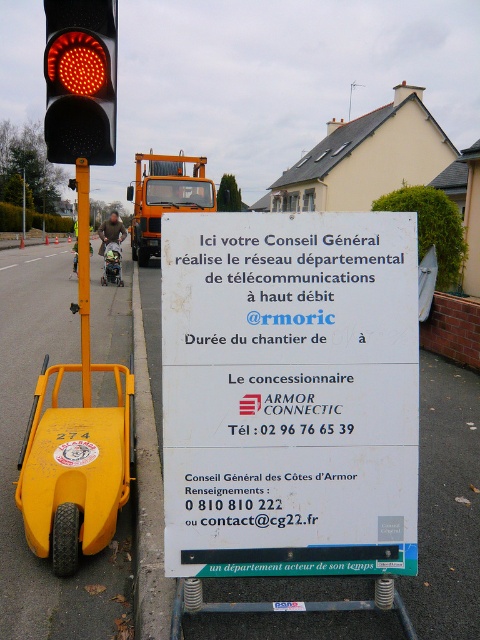
Locate an element on the screen. This screenshot has height=640, width=480. white plastic sign at center is located at coordinates (289, 394).

Based on the photo, does white plastic sign at center have a greater width compared to yellow plastic pole at left?

No.

Find the location of `white plastic sign at center`. white plastic sign at center is located at coordinates (289, 394).

Identify the location of white plastic sign at center. (289, 394).

Does white plastic sign at center lie behind yellow matte toy car at lower left?

No, white plastic sign at center is in front of yellow matte toy car at lower left.

Is white plastic sign at center to the left of yellow matte toy car at lower left from the viewer's perspective?

Incorrect, white plastic sign at center is not on the left side of yellow matte toy car at lower left.

Who is more forward, (400, 408) or (44, 426)?

Positioned in front is point (400, 408).

The image size is (480, 640). I want to click on white plastic sign at center, so click(289, 394).

Does yellow matte toy car at lower left appear under matte black traffic light at upper left?

Indeed, yellow matte toy car at lower left is positioned under matte black traffic light at upper left.

Between point (40, 556) and point (48, 116), which one is positioned behind?

Point (48, 116)

I want to click on yellow matte toy car at lower left, so click(x=73, y=470).